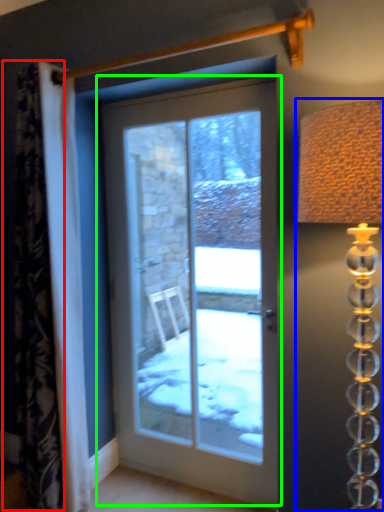
Question: Considering the real-world distances, which object is farthest from curtain (highlighted by a red box)? table lamp (highlighted by a blue box) or door (highlighted by a green box)?

Choices:
 (A) table lamp
 (B) door

Answer: (B)